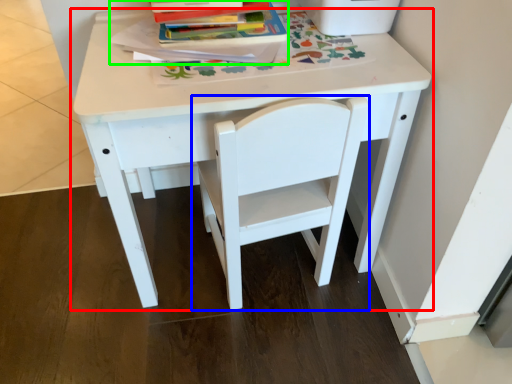
Question: Which is nearer to the table (highlighted by a red box)? chair (highlighted by a blue box) or paperback book (highlighted by a green box).

Choices:
 (A) chair
 (B) paperback book

Answer: (A)